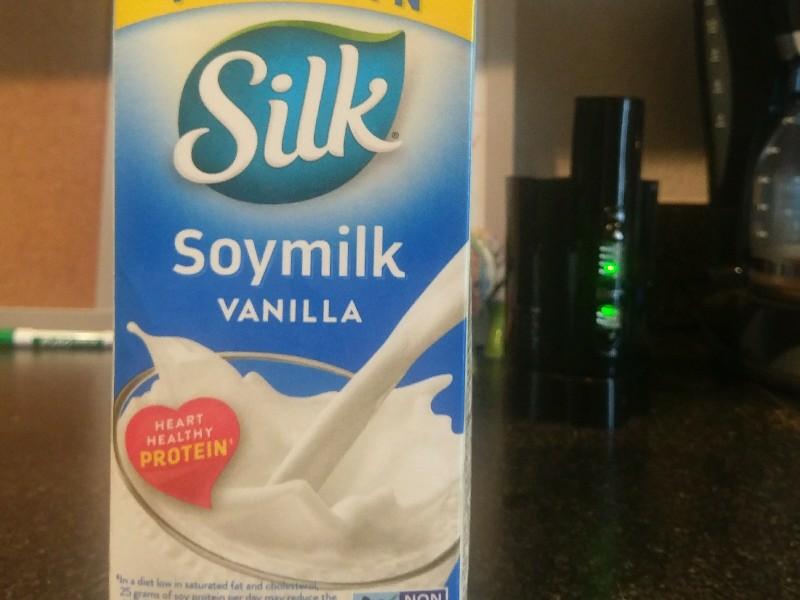
This screenshot has height=600, width=800. I want to click on marker, so click(x=49, y=335).